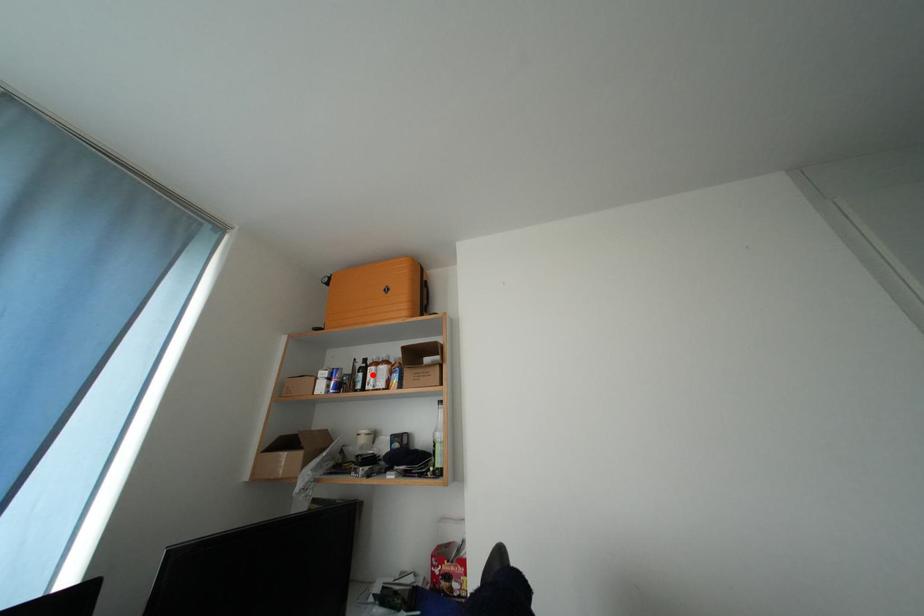
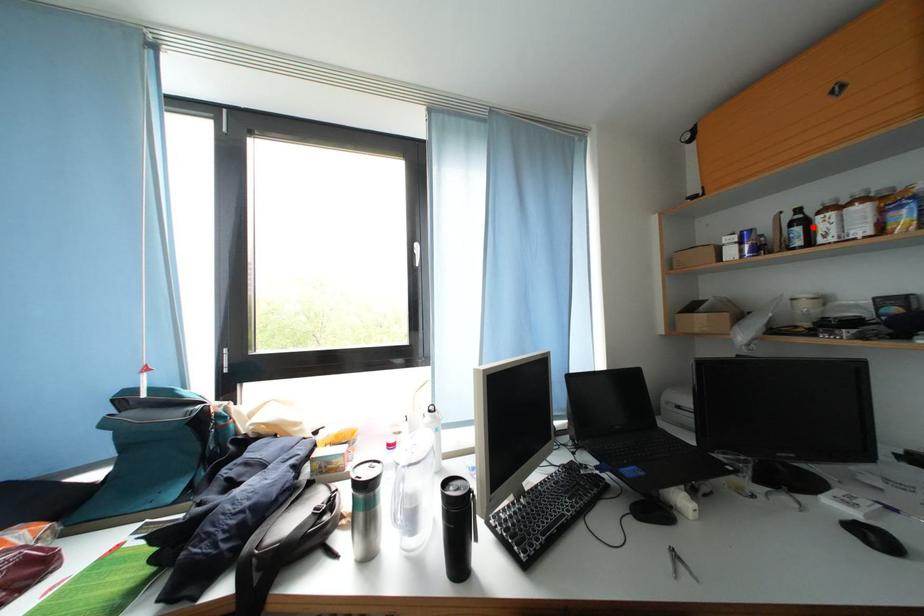
I am providing you with two images of the same scene from different viewpoints. A red point is marked on the first image and another point is marked on the second image. Are the points marked in image1 and image2 representing the same 3D position?

Yes